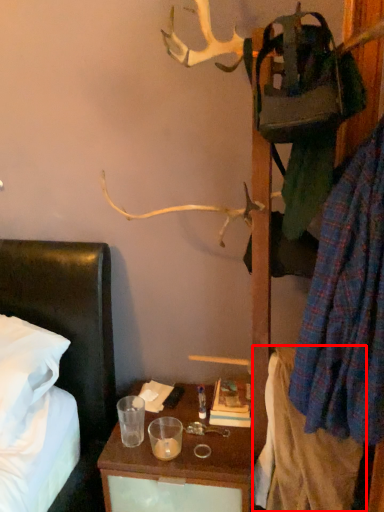
Question: From the image's perspective, considering the relative positions of clothing (annotated by the red box) and clothing in the image provided, where is clothing (annotated by the red box) located with respect to the staircase?

Choices:
 (A) above
 (B) below

Answer: (B)